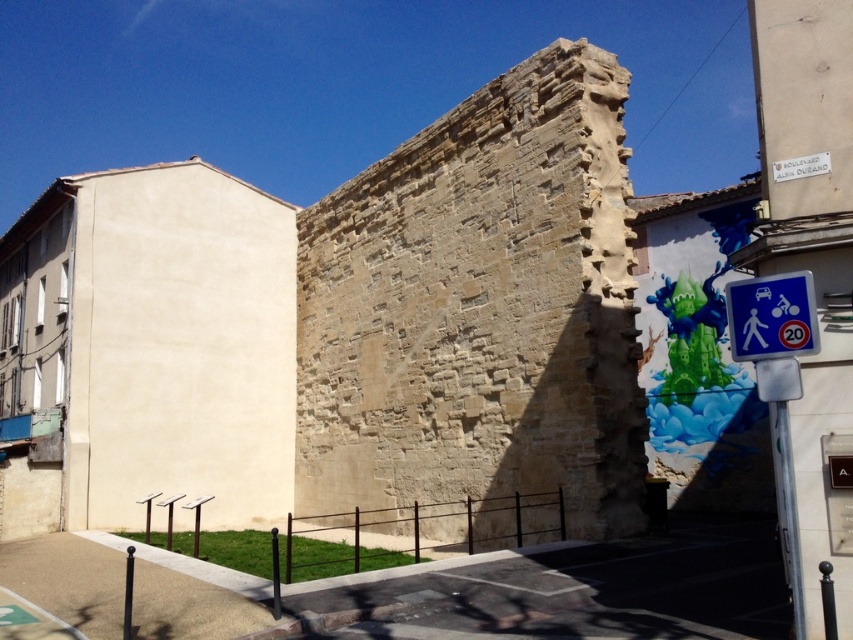
What do you see at coordinates (480, 308) in the screenshot? I see `brown stone wall at center` at bounding box center [480, 308].

This screenshot has width=853, height=640. I want to click on brown stone wall at center, so click(480, 308).